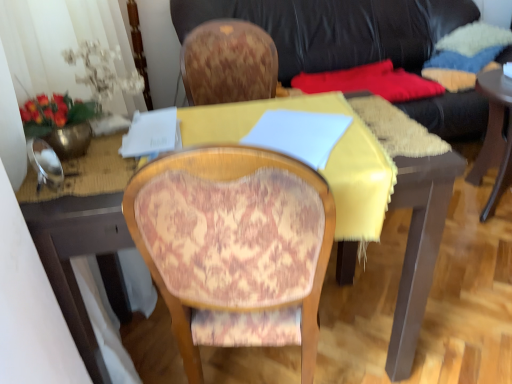
Question: Is patterned fabric chair at center not inside black leather couch at upper center?

Choices:
 (A) yes
 (B) no

Answer: (A)

Question: Does patterned fabric chair at center have a smaller size compared to black leather couch at upper center?

Choices:
 (A) yes
 (B) no

Answer: (A)

Question: Can you confirm if patterned fabric chair at center is shorter than black leather couch at upper center?

Choices:
 (A) no
 (B) yes

Answer: (A)

Question: Could you tell me if patterned fabric chair at center is turned towards black leather couch at upper center?

Choices:
 (A) yes
 (B) no

Answer: (A)

Question: Is black leather couch at upper center completely or partially inside patterned fabric chair at center?

Choices:
 (A) yes
 (B) no

Answer: (B)

Question: Choose the correct answer: Is patterned fabric chair at center inside black leather couch at upper center or outside it?

Choices:
 (A) outside
 (B) inside

Answer: (A)

Question: In terms of width, does patterned fabric chair at center look wider or thinner when compared to black leather couch at upper center?

Choices:
 (A) thin
 (B) wide

Answer: (A)

Question: Looking at the image, does patterned fabric chair at center seem bigger or smaller compared to black leather couch at upper center?

Choices:
 (A) big
 (B) small

Answer: (B)

Question: From a real-world perspective, is patterned fabric chair at center positioned above or below black leather couch at upper center?

Choices:
 (A) above
 (B) below

Answer: (B)

Question: Is black leather couch at upper center bigger or smaller than patterned fabric chair at center?

Choices:
 (A) big
 (B) small

Answer: (A)

Question: Considering the positions of point (355, 23) and point (202, 155), is point (355, 23) closer or farther from the camera than point (202, 155)?

Choices:
 (A) farther
 (B) closer

Answer: (A)

Question: Considering the positions of black leather couch at upper center and patterned fabric chair at center in the image, is black leather couch at upper center wider or thinner than patterned fabric chair at center?

Choices:
 (A) thin
 (B) wide

Answer: (B)

Question: Is black leather couch at upper center inside the boundaries of patterned fabric chair at center, or outside?

Choices:
 (A) outside
 (B) inside

Answer: (A)

Question: From the image's perspective, relative to yellow fabric-covered desk at center, is black leather couch at upper center above or below?

Choices:
 (A) below
 (B) above

Answer: (B)

Question: Is black leather couch at upper center in front of or behind yellow fabric-covered desk at center in the image?

Choices:
 (A) behind
 (B) front

Answer: (A)